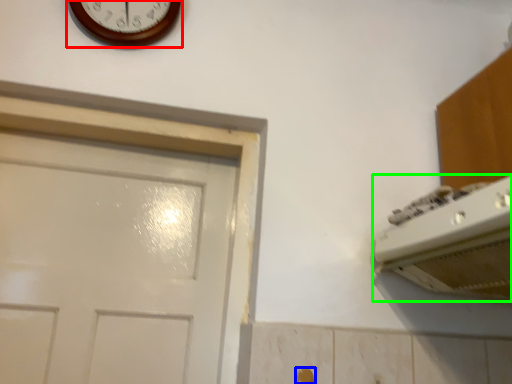
Question: Which is farther away from wall clock (highlighted by a red box)? door handle (highlighted by a blue box) or appliance (highlighted by a green box)?

Choices:
 (A) door handle
 (B) appliance

Answer: (A)